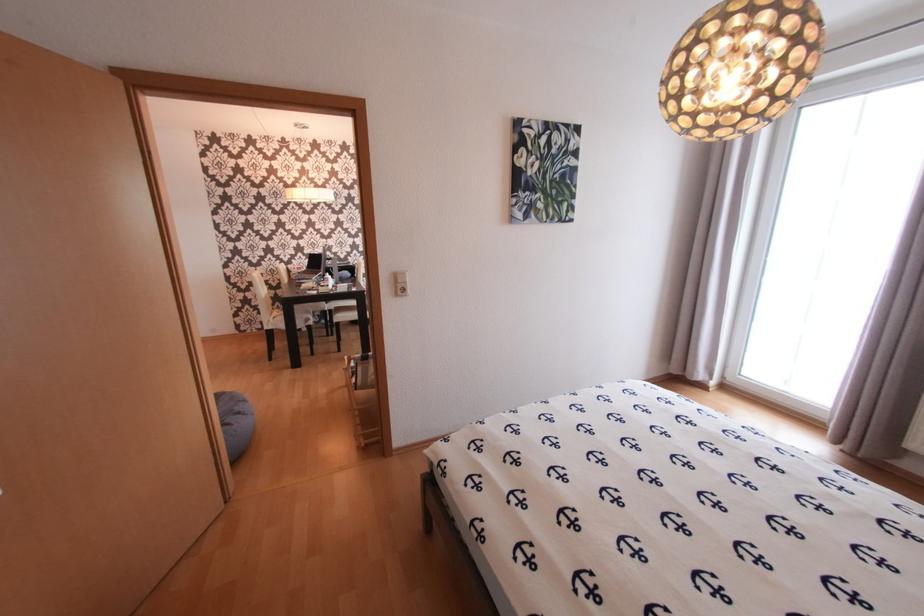
You are a GUI agent. You are given a task and a screenshot of the screen. Output one action in this format:
    pyautogui.click(x=<x>, y=<y>)
    Task: Click on the wall light switch
    
    Given the screenshot: What is the action you would take?
    pyautogui.click(x=399, y=277)